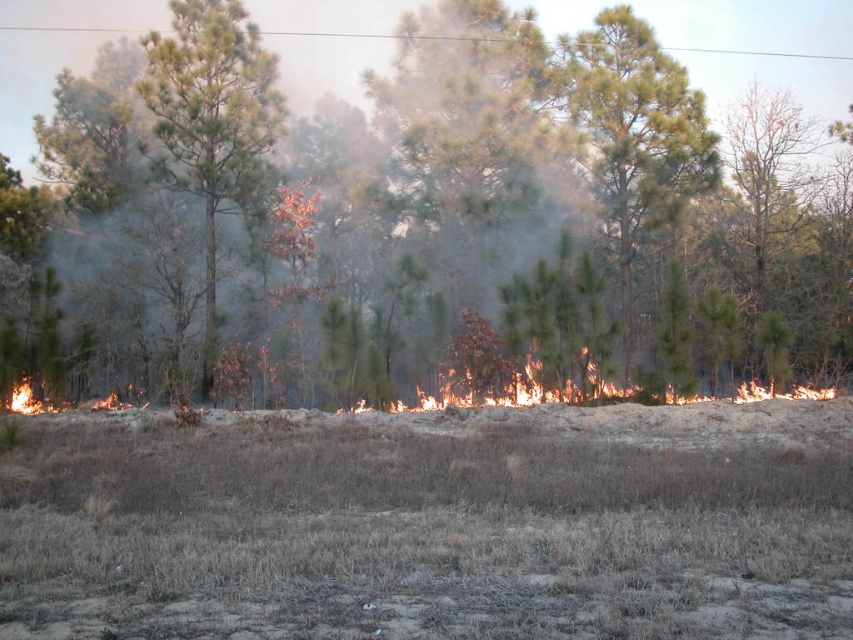
Question: Estimate the real-world distances between objects in this image. Which object is farther from the green matte tree at center?

Choices:
 (A) brown dry grass at lower center
 (B) flaming flames at center
 (C) green leafy tree at center

Answer: (A)

Question: Estimate the real-world distances between objects in this image. Which object is closer to the green leafy tree at center?

Choices:
 (A) brown dry grass at lower center
 (B) green needle-like tree at center

Answer: (B)

Question: Which of these objects is positioned farthest from the flaming flames at center?

Choices:
 (A) green leafy tree at center
 (B) green needle-like tree at center
 (C) brown dry grass at lower center

Answer: (A)

Question: Is green leafy tree at center positioned before flaming flames at center?

Choices:
 (A) no
 (B) yes

Answer: (A)

Question: Is green matte tree at center in front of flaming flames at center?

Choices:
 (A) no
 (B) yes

Answer: (A)

Question: Does green needle-like tree at center have a greater width compared to flaming flames at center?

Choices:
 (A) no
 (B) yes

Answer: (A)